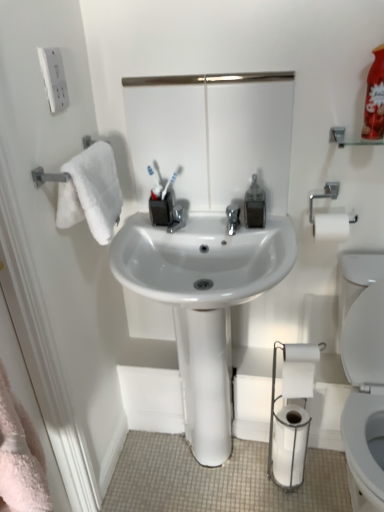
The image size is (384, 512). Describe the element at coordinates (213, 135) in the screenshot. I see `white glossy mirror at upper center` at that location.

This screenshot has height=512, width=384. Identify the location of white matte toilet paper at lower right, the 1th toilet paper positioned from the bottom. tap(289, 445).

Describe the element at coordinates (299, 370) in the screenshot. The image size is (384, 512). I see `white matte toilet paper at lower right, the 2th toilet paper positioned from the bottom` at that location.

At what (x,y) coordinates should I click in order to perform the action: click on white glossy mirror at upper center. Please return your answer as a coordinate pair (x, y). Image resolution: width=384 pixels, height=512 pixels. Looking at the image, I should click on (213, 135).

In the image, there is a white plastic toothbrush at center. Identify the location of sink below it (from a real-world perspective). (203, 303).

Between white plastic toothbrush at center and white glossy sink at center, which one has larger size?

white glossy sink at center is bigger.

From a real-world perspective, is white plastic toothbrush at center physically below white glossy sink at center?

Incorrect, from a real-world perspective, white plastic toothbrush at center is higher than white glossy sink at center.

Is white plastic toothbrush at center positioned behind white glossy sink at center?

Yes, white plastic toothbrush at center is further from the viewer.

Considering the relative sizes of white glossy sink at center and white glossy mirror at upper center in the image provided, is white glossy sink at center smaller than white glossy mirror at upper center?

No.

Considering the sizes of white glossy sink at center and white glossy mirror at upper center in the image, is white glossy sink at center wider or thinner than white glossy mirror at upper center?

Considering their sizes, white glossy sink at center looks broader than white glossy mirror at upper center.

From a real-world perspective, is white glossy sink at center positioned over white glossy mirror at upper center based on gravity?

No, from a real-world perspective, white glossy sink at center is not on top of white glossy mirror at upper center.

Is white glossy mirror at upper center at the back of white glossy sink at center?

No, white glossy sink at center is not facing away from white glossy mirror at upper center.

Can you see white plastic toothbrush at center touching white matte toilet paper at lower right, the 2th toilet paper from the top?

No, white plastic toothbrush at center is not in contact with white matte toilet paper at lower right, the 2th toilet paper from the top.

Does point (149, 170) lie behind point (295, 479)?

No.

From the picture: From a real-world perspective, is white plastic toothbrush at center physically located above or below white matte toilet paper at lower right, the 1th toilet paper positioned from the bottom?

From a real-world perspective, white plastic toothbrush at center is physically above white matte toilet paper at lower right, the 1th toilet paper positioned from the bottom.

How different are the orientations of white plastic toothbrush at center and white matte toilet paper at lower right, the 1th toilet paper positioned from the bottom, in degrees?

The angular difference between white plastic toothbrush at center and white matte toilet paper at lower right, the 1th toilet paper positioned from the bottom, is 0.283 degrees.

From the image's perspective, is clear plastic soap dispenser at center beneath white plastic toothbrush at center?

Yes, from the image's perspective, clear plastic soap dispenser at center is beneath white plastic toothbrush at center.

Considering the relative sizes of clear plastic soap dispenser at center and white plastic toothbrush at center in the image provided, is clear plastic soap dispenser at center thinner than white plastic toothbrush at center?

In fact, clear plastic soap dispenser at center might be wider than white plastic toothbrush at center.

Identify the location of toothbrush that appears above the clear plastic soap dispenser at center (from a real-world perspective). This screenshot has width=384, height=512. (155, 184).

Is clear plastic soap dispenser at center oriented towards white plastic toothbrush at center?

No, clear plastic soap dispenser at center does not turn towards white plastic toothbrush at center.

Would you say white matte toilet paper at lower right, the 2th toilet paper from the top, is inside or outside clear plastic soap dispenser at center?

white matte toilet paper at lower right, the 2th toilet paper from the top, is outside clear plastic soap dispenser at center.

Could you tell me if white matte toilet paper at lower right, the 2th toilet paper from the top, is turned towards clear plastic soap dispenser at center?

→ No, white matte toilet paper at lower right, the 2th toilet paper from the top, is not aimed at clear plastic soap dispenser at center.

Does white matte toilet paper at lower right, the 1th toilet paper positioned from the bottom, have a lesser height compared to clear plastic soap dispenser at center?

No, white matte toilet paper at lower right, the 1th toilet paper positioned from the bottom, is not shorter than clear plastic soap dispenser at center.

In terms of size, does white matte toilet paper at lower right, the 1th toilet paper positioned from the bottom, appear bigger or smaller than clear plastic soap dispenser at center?

Clearly, white matte toilet paper at lower right, the 1th toilet paper positioned from the bottom, is larger in size than clear plastic soap dispenser at center.

Can we say white matte toilet paper at lower right, acting as the 1th toilet paper starting from the top, lies outside white matte toilet paper at lower right, the 2th toilet paper from the top?

Indeed, white matte toilet paper at lower right, acting as the 1th toilet paper starting from the top, is completely outside white matte toilet paper at lower right, the 2th toilet paper from the top.

Consider the image. Between white matte toilet paper at lower right, acting as the 1th toilet paper starting from the top, and white matte toilet paper at lower right, the 1th toilet paper positioned from the bottom, which one has more height?

white matte toilet paper at lower right, the 1th toilet paper positioned from the bottom.

From a real-world perspective, is white matte toilet paper at lower right, the 2th toilet paper positioned from the bottom, positioned over white matte toilet paper at lower right, the 1th toilet paper positioned from the bottom, based on gravity?

Yes, from a real-world perspective, white matte toilet paper at lower right, the 2th toilet paper positioned from the bottom, is over white matte toilet paper at lower right, the 1th toilet paper positioned from the bottom

Is white matte toilet paper at lower right, the 2th toilet paper from the top, positioned far away from white glossy sink at center?

No, there isn't a large distance between white matte toilet paper at lower right, the 2th toilet paper from the top, and white glossy sink at center.

Between white matte toilet paper at lower right, the 2th toilet paper from the top, and white glossy sink at center, which one has less height?

Standing shorter between the two is white matte toilet paper at lower right, the 2th toilet paper from the top.

Could you tell me if white matte toilet paper at lower right, the 2th toilet paper from the top, is turned towards white glossy sink at center?

Yes, white matte toilet paper at lower right, the 2th toilet paper from the top, is facing white glossy sink at center.

Locate an element on the screen. The image size is (384, 512). sink to the right of white plastic toothbrush at center is located at coordinates (203, 303).

This screenshot has height=512, width=384. What are the coordinates of `sink below the white glossy mirror at upper center (from a real-world perspective)` in the screenshot? It's located at (203, 303).

Looking at the image, which one is located closer to white plastic toothbrush at center, white glossy sink at center or white matte toilet paper at lower right, the 2th toilet paper from the top?

white glossy sink at center lies closer to white plastic toothbrush at center than the other object.

Looking at the image, which one is located closer to white glossy sink at center, clear plastic soap dispenser at center or white matte toilet paper at lower right, acting as the 1th toilet paper starting from the top?

white matte toilet paper at lower right, acting as the 1th toilet paper starting from the top, lies closer to white glossy sink at center than the other object.

Estimate the real-world distances between objects in this image. Which object is closer to white matte toilet paper at lower right, the 1th toilet paper positioned from the bottom, clear plastic soap dispenser at center or white glossy sink at center?

Based on the image, white glossy sink at center appears to be nearer to white matte toilet paper at lower right, the 1th toilet paper positioned from the bottom.

Which object lies nearer to the anchor point white matte toilet paper at lower right, the 1th toilet paper positioned from the bottom, white glossy mirror at upper center or clear plastic soap dispenser at center?

Among the two, clear plastic soap dispenser at center is located nearer to white matte toilet paper at lower right, the 1th toilet paper positioned from the bottom.

Which object lies nearer to the anchor point clear plastic soap dispenser at center, white plastic toothbrush at center or white glossy mirror at upper center?

white glossy mirror at upper center.

From the image, which object appears to be farther from white matte toilet paper at lower right, the 1th toilet paper positioned from the bottom, white glossy sink at center or clear plastic soap dispenser at center?

Among the two, clear plastic soap dispenser at center is located further to white matte toilet paper at lower right, the 1th toilet paper positioned from the bottom.

Looking at the image, which one is located further to white glossy mirror at upper center, white matte toilet paper at lower right, the 2th toilet paper from the top, or clear plastic soap dispenser at center?

white matte toilet paper at lower right, the 2th toilet paper from the top, is positioned further to the anchor white glossy mirror at upper center.

When comparing their distances from white matte toilet paper at lower right, acting as the 1th toilet paper starting from the top, does white glossy mirror at upper center or white matte toilet paper at lower right, the 1th toilet paper positioned from the bottom, seem closer?

Among the two, white matte toilet paper at lower right, the 1th toilet paper positioned from the bottom, is located nearer to white matte toilet paper at lower right, acting as the 1th toilet paper starting from the top.

This screenshot has height=512, width=384. I want to click on toilet paper between white plastic toothbrush at center and white matte toilet paper at lower right, the 2th toilet paper from the top, vertically, so click(x=299, y=370).

The height and width of the screenshot is (512, 384). In order to click on sink that lies between clear plastic soap dispenser at center and white matte toilet paper at lower right, the 2th toilet paper positioned from the bottom, from top to bottom in this screenshot , I will do `click(203, 303)`.

Where is `toothbrush between white glossy mirror at upper center and white matte toilet paper at lower right, the 1th toilet paper positioned from the bottom, in the vertical direction`? toothbrush between white glossy mirror at upper center and white matte toilet paper at lower right, the 1th toilet paper positioned from the bottom, in the vertical direction is located at coordinates (155, 184).

What are the coordinates of `soap dispenser between white glossy mirror at upper center and white glossy sink at center vertically` in the screenshot? It's located at (255, 205).